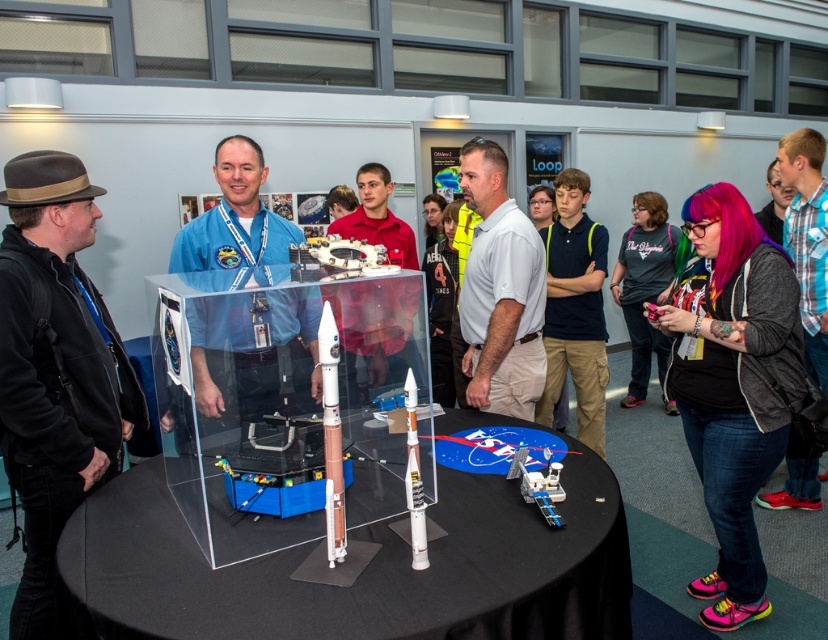
You are an attendee at the space exploration event. You want to take a photo of the clear acrylic table at center without the white shirt at center appearing in the shot. How can you position yourself to achieve this?

Since the clear acrylic table at center is in front of the white shirt at center, you can position yourself behind the clear acrylic table at center so that the table blocks the view of the white shirt at center.

You are standing at the center of the room and see the point labeled as point (414, 480). Which object is this point located on?

The point labeled as point (414, 480) is located on the white matte rocket at center.

From the picture: You are an attendee at the space exhibition and you notice the blue plaid shirt at right and the white matte rocket at center. Which object is covering the other one?

The blue plaid shirt at right is positioned over the white matte rocket at center, so it is covering it.